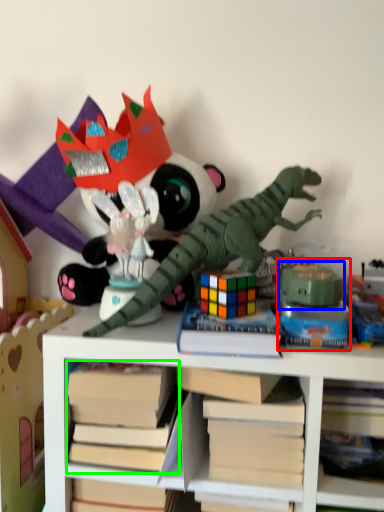
Question: Which is nearer to the toy (highlighted by a red box)? toy (highlighted by a blue box) or book (highlighted by a green box).

Choices:
 (A) toy
 (B) book

Answer: (A)